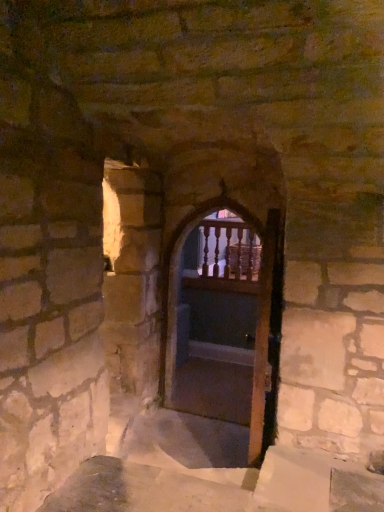
Question: Does wooden screen door at center have a smaller size compared to wooden balusters at center?

Choices:
 (A) no
 (B) yes

Answer: (A)

Question: Is wooden screen door at center positioned behind wooden balusters at center?

Choices:
 (A) no
 (B) yes

Answer: (A)

Question: Considering the relative sizes of wooden screen door at center and wooden balusters at center in the image provided, is wooden screen door at center thinner than wooden balusters at center?

Choices:
 (A) no
 (B) yes

Answer: (A)

Question: Is wooden screen door at center closer to the viewer compared to wooden balusters at center?

Choices:
 (A) yes
 (B) no

Answer: (A)

Question: Is wooden screen door at center at the left side of wooden balusters at center?

Choices:
 (A) no
 (B) yes

Answer: (A)

Question: Could you tell me if wooden screen door at center is turned towards wooden balusters at center?

Choices:
 (A) yes
 (B) no

Answer: (B)

Question: From a real-world perspective, is wooden balusters at center on wooden at center?

Choices:
 (A) no
 (B) yes

Answer: (B)

Question: Can you confirm if wooden balusters at center is wider than wooden at center?

Choices:
 (A) yes
 (B) no

Answer: (B)

Question: From the image's perspective, is wooden balusters at center under wooden at center?

Choices:
 (A) yes
 (B) no

Answer: (B)

Question: Is wooden balusters at center oriented away from wooden at center?

Choices:
 (A) no
 (B) yes

Answer: (A)

Question: Are wooden balusters at center and wooden at center located far from each other?

Choices:
 (A) no
 (B) yes

Answer: (A)

Question: From the image's perspective, does wooden balusters at center appear higher than wooden at center?

Choices:
 (A) no
 (B) yes

Answer: (B)

Question: Considering the relative positions of wooden at center and wooden screen door at center in the image provided, is wooden at center to the right of wooden screen door at center from the viewer's perspective?

Choices:
 (A) yes
 (B) no

Answer: (B)